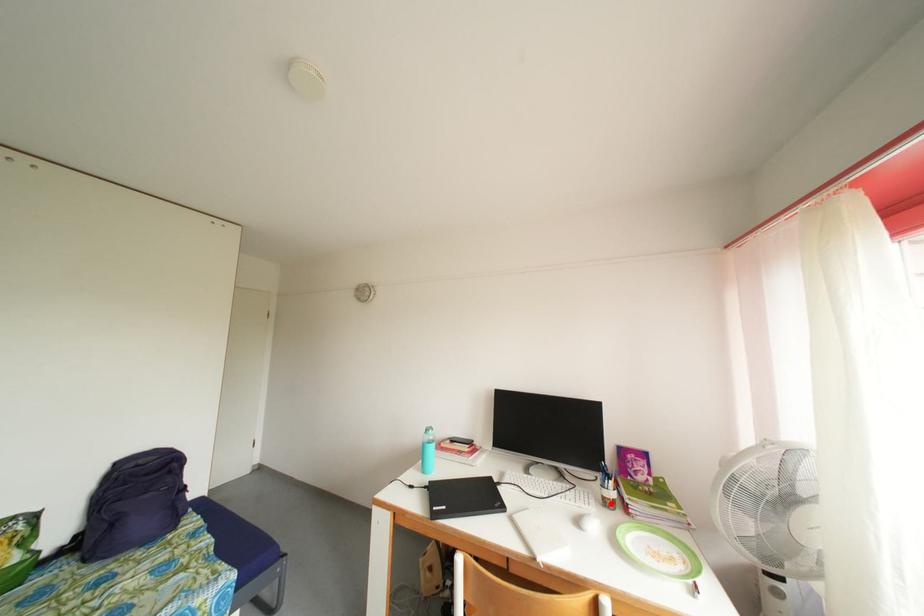
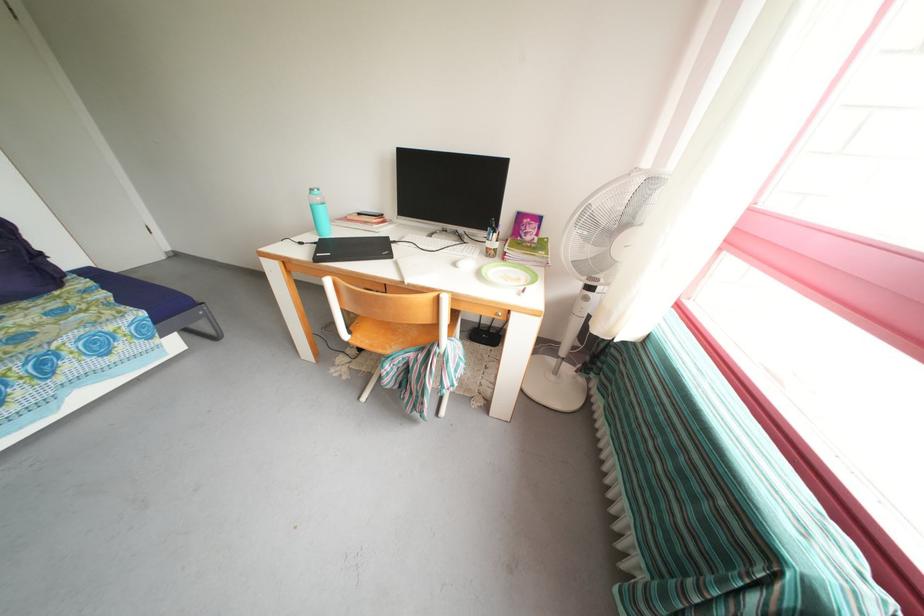
Question: I am providing you with two images of the same scene from different viewpoints. Image1 has a red point marked. In image2, the corresponding 3D location appears at what relative position? Reply with the corresponding letter.

Choices:
 (A) Closer
 (B) Farther

Answer: (A)